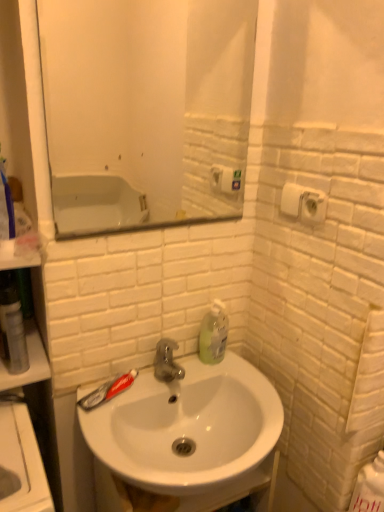
At what (x,y) coordinates should I click in order to perform the action: click on free space on the front side of translucent plastic toothpaste at sink left. Please return your answer as a coordinate pair (x, y). Looking at the image, I should click on (108, 428).